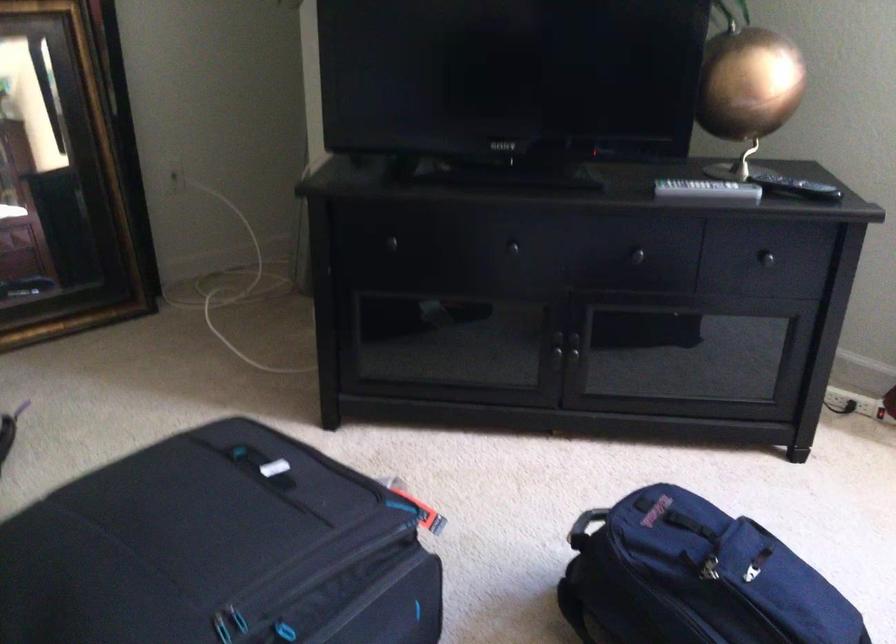
Identify the location of backpack zipper pull. The height and width of the screenshot is (644, 896). (756, 564).